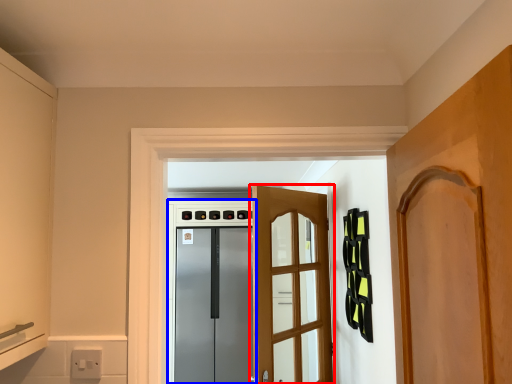
Question: Which object is further to the camera taking this photo, door (highlighted by a red box) or appliance (highlighted by a blue box)?

Choices:
 (A) door
 (B) appliance

Answer: (B)